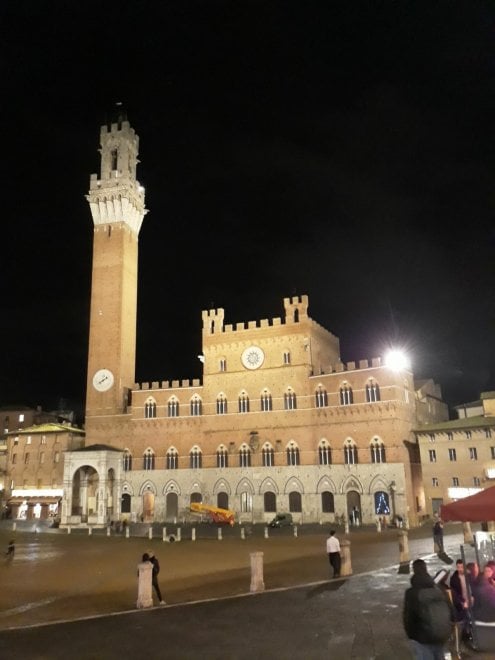
What are the coordinates of `window with white lights` in the screenshot? It's located at (384, 504).